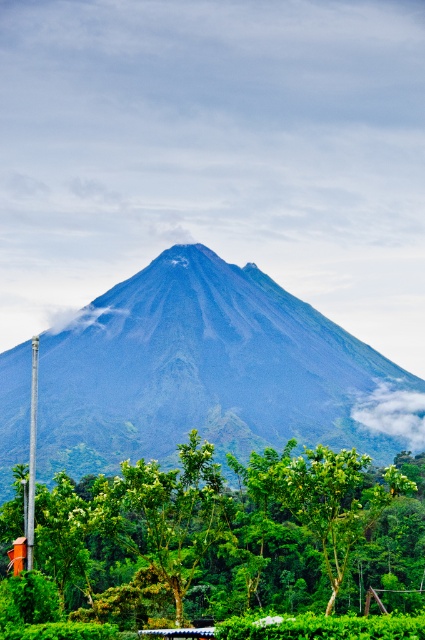
You are a hiker standing at the base of the volcano and see the green leafy tree at center and the metallic pole at left. Which object is closer to your left side?

The metallic pole at left is closer to your left side because it is positioned to the left of the green leafy tree at center.

You are a hiker planning to climb the dark gray volcanic rock mountain at center. You have a map showing a point at coordinates [210,372]. Where is this point located on the mountain?

The point at coordinates [210,372] represents the dark gray volcanic rock mountain at center.